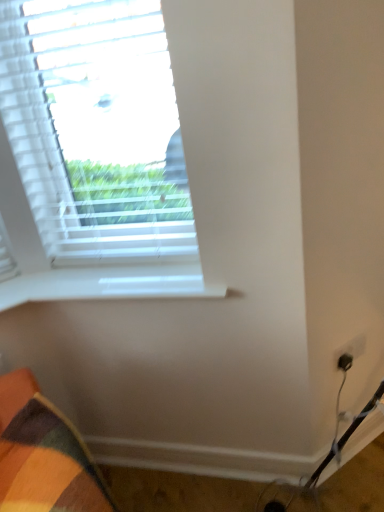
Question: In terms of size, does white smooth window sill at upper left appear bigger or smaller than white matte window at upper left?

Choices:
 (A) small
 (B) big

Answer: (A)

Question: Considering the relative positions of white smooth window sill at upper left and white matte window at upper left in the image provided, is white smooth window sill at upper left to the left or to the right of white matte window at upper left?

Choices:
 (A) left
 (B) right

Answer: (B)

Question: Is white smooth window sill at upper left in front of or behind white matte window at upper left in the image?

Choices:
 (A) front
 (B) behind

Answer: (B)

Question: Considering the relative positions of white matte window at upper left and white smooth window sill at upper left in the image provided, is white matte window at upper left to the left or to the right of white smooth window sill at upper left?

Choices:
 (A) left
 (B) right

Answer: (A)

Question: Does point (117, 224) appear closer or farther from the camera than point (21, 291)?

Choices:
 (A) closer
 (B) farther

Answer: (B)

Question: From the image's perspective, is white matte window at upper left above or below white smooth window sill at upper left?

Choices:
 (A) above
 (B) below

Answer: (A)

Question: Looking at the image, does white matte window at upper left seem bigger or smaller compared to white smooth window sill at upper left?

Choices:
 (A) big
 (B) small

Answer: (A)